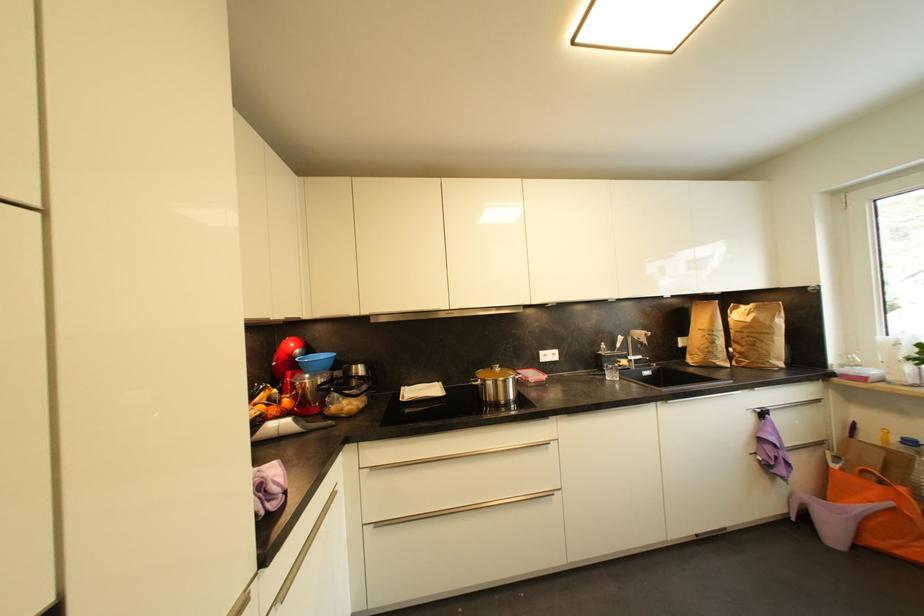
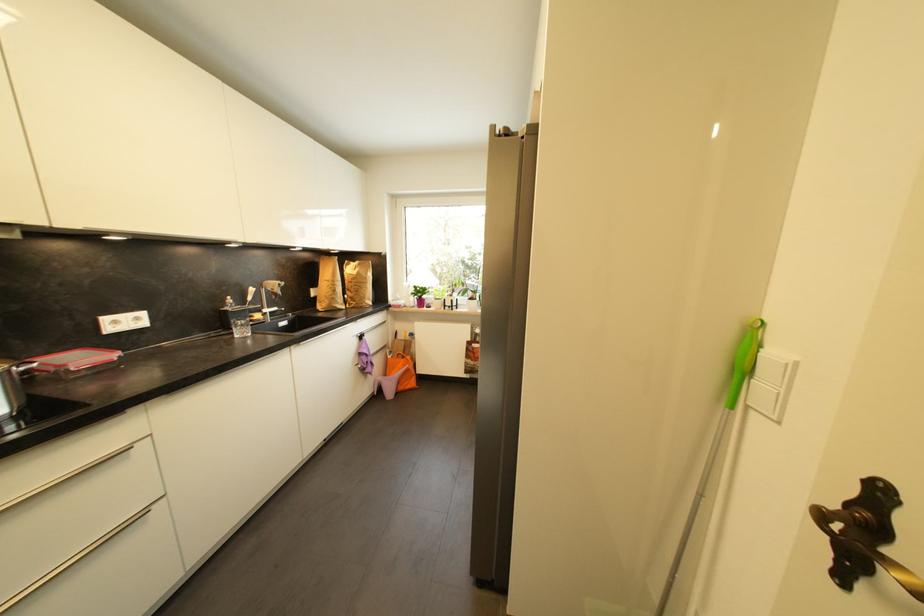
Locate, in the second image, the point that corresponds to point (528, 371) in the first image.

(54, 355)